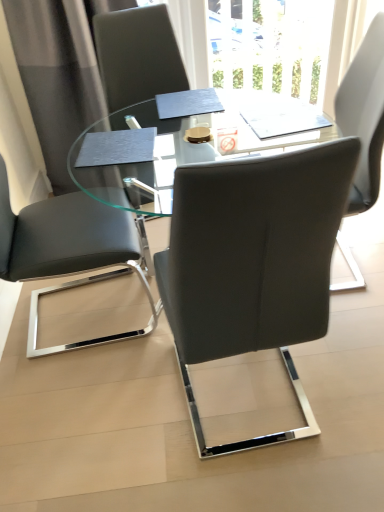
The image size is (384, 512). What are the coordinates of `vacant area that lies between matte black chair at left, acting as the 2th chair starting from the right, and transparent glass table at center` in the screenshot? It's located at (91, 348).